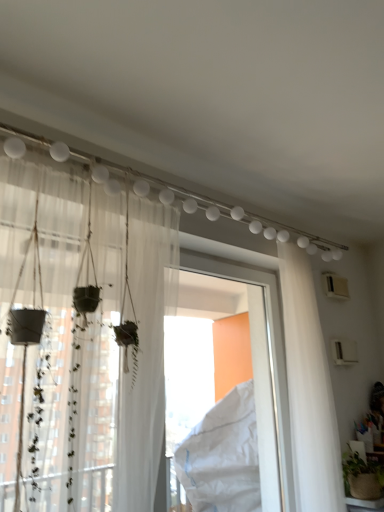
How much space does sheer white curtain at left, marked as the first curtain in a front-to-back arrangement, occupy vertically?

3.99 feet.

The width and height of the screenshot is (384, 512). In order to click on white sheer curtain at right, the second curtain in the left-to-right sequence in this screenshot , I will do `click(309, 389)`.

Would you say sheer white curtain at left, the second curtain when ordered from right to left, is inside or outside white plastic window frame at center?

sheer white curtain at left, the second curtain when ordered from right to left, is not enclosed by white plastic window frame at center.

Which point is more distant from viewer, (142, 232) or (269, 414)?

The point (269, 414) is more distant.

Considering the sizes of objects sheer white curtain at left, marked as the first curtain in a front-to-back arrangement, and white plastic window frame at center in the image provided, who is wider, sheer white curtain at left, marked as the first curtain in a front-to-back arrangement, or white plastic window frame at center?

Wider between the two is sheer white curtain at left, marked as the first curtain in a front-to-back arrangement.

Is sheer white curtain at left, the second curtain when ordered from right to left, bigger than white plastic window frame at center?

Yes, sheer white curtain at left, the second curtain when ordered from right to left, is bigger than white plastic window frame at center.

Is white sheer curtain at right, the 1th curtain viewed from the back, oriented towards white plastic window frame at center?

No, white sheer curtain at right, the 1th curtain viewed from the back, is not aimed at white plastic window frame at center.

Relative to white plastic window frame at center, is white sheer curtain at right, the 1th curtain viewed from the back, in front or behind?

In the image, white sheer curtain at right, the 1th curtain viewed from the back, appears behind white plastic window frame at center.

Is white sheer curtain at right, which ranks as the first curtain in right-to-left order, at the right side of white plastic window frame at center?

Correct, you'll find white sheer curtain at right, which ranks as the first curtain in right-to-left order, to the right of white plastic window frame at center.

From a real-world perspective, is white sheer curtain at right, which ranks as the first curtain in right-to-left order, physically above sheer white curtain at left, the second curtain when ordered from right to left?

No, from a real-world perspective, white sheer curtain at right, which ranks as the first curtain in right-to-left order, is not above sheer white curtain at left, the second curtain when ordered from right to left.

Can you confirm if white sheer curtain at right, the second curtain in the left-to-right sequence, is wider than sheer white curtain at left, marked as the first curtain in a front-to-back arrangement?

No.

How far apart are white sheer curtain at right, which ranks as the first curtain in right-to-left order, and sheer white curtain at left, the 2th curtain from the back?

white sheer curtain at right, which ranks as the first curtain in right-to-left order, and sheer white curtain at left, the 2th curtain from the back, are 1.02 meters apart.

From their relative heights in the image, would you say white sheer curtain at right, which ranks as the first curtain in right-to-left order, is taller or shorter than sheer white curtain at left, the 2th curtain from the back?

In the image, white sheer curtain at right, which ranks as the first curtain in right-to-left order, appears to be taller than sheer white curtain at left, the 2th curtain from the back.

How far apart are white plastic window frame at center and white sheer curtain at right, the 1th curtain viewed from the back?

24.78 centimeters.

Considering the sizes of objects white plastic window frame at center and white sheer curtain at right, the 1th curtain viewed from the back, in the image provided, who is bigger, white plastic window frame at center or white sheer curtain at right, the 1th curtain viewed from the back,?

Bigger between the two is white plastic window frame at center.

From the image's perspective, which object appears higher, white plastic window frame at center or white sheer curtain at right, the second curtain in the left-to-right sequence?

white sheer curtain at right, the second curtain in the left-to-right sequence, from the image's perspective.

Considering the sizes of white plastic window frame at center and white sheer curtain at right, the second curtain viewed from the front, in the image, is white plastic window frame at center taller or shorter than white sheer curtain at right, the second curtain viewed from the front,?

In the image, white plastic window frame at center appears to be shorter than white sheer curtain at right, the second curtain viewed from the front.

Considering the sizes of sheer white curtain at left, marked as the first curtain in a front-to-back arrangement, and white sheer curtain at right, the 1th curtain viewed from the back, in the image, is sheer white curtain at left, marked as the first curtain in a front-to-back arrangement, wider or thinner than white sheer curtain at right, the 1th curtain viewed from the back,?

Considering their sizes, sheer white curtain at left, marked as the first curtain in a front-to-back arrangement, looks broader than white sheer curtain at right, the 1th curtain viewed from the back.

From a real-world perspective, which is physically below, sheer white curtain at left, the second curtain when ordered from right to left, or white sheer curtain at right, which ranks as the first curtain in right-to-left order?

white sheer curtain at right, which ranks as the first curtain in right-to-left order.

Which is correct: sheer white curtain at left, the 1th curtain viewed from the left, is inside white sheer curtain at right, which ranks as the first curtain in right-to-left order, or outside of it?

sheer white curtain at left, the 1th curtain viewed from the left, is outside white sheer curtain at right, which ranks as the first curtain in right-to-left order.

Is sheer white curtain at left, the 2th curtain from the back, bigger than white sheer curtain at right, the second curtain viewed from the front?

Yes.

Is white plastic window frame at center turned away from sheer white curtain at left, the 1th curtain viewed from the left?

white plastic window frame at center does not have its back to sheer white curtain at left, the 1th curtain viewed from the left.

Can you confirm if white plastic window frame at center is thinner than sheer white curtain at left, the 2th curtain from the back?

Yes, white plastic window frame at center is thinner than sheer white curtain at left, the 2th curtain from the back.

Does white plastic window frame at center have a greater height compared to sheer white curtain at left, marked as the first curtain in a front-to-back arrangement?

Indeed, white plastic window frame at center has a greater height compared to sheer white curtain at left, marked as the first curtain in a front-to-back arrangement.

Is point (268, 282) positioned before point (112, 424)?

No, it is behind (112, 424).

From the image's perspective, starting from the white plastic window frame at center, which curtain is the 2nd one above? Please provide its 2D coordinates.

[(82, 337)]

Identify the location of window frame on the left of white sheer curtain at right, the second curtain viewed from the front. (262, 374).

Considering their positions, is white sheer curtain at right, the 1th curtain viewed from the back, positioned closer to white plastic window frame at center than sheer white curtain at left, the second curtain when ordered from right to left?

white sheer curtain at right, the 1th curtain viewed from the back, lies closer to white plastic window frame at center than the other object.

Based on their spatial positions, is white sheer curtain at right, the second curtain in the left-to-right sequence, or white plastic window frame at center further from sheer white curtain at left, the 2th curtain from the back?

white sheer curtain at right, the second curtain in the left-to-right sequence, is further to sheer white curtain at left, the 2th curtain from the back.

Estimate the real-world distances between objects in this image. Which object is further from sheer white curtain at left, the 2th curtain from the back, white plastic window frame at center or white sheer curtain at right, which ranks as the first curtain in right-to-left order?

white sheer curtain at right, which ranks as the first curtain in right-to-left order, is positioned further to the anchor sheer white curtain at left, the 2th curtain from the back.

Based on the photo, considering their positions, is sheer white curtain at left, the second curtain when ordered from right to left, positioned further to white sheer curtain at right, the 1th curtain viewed from the back, than white plastic window frame at center?

sheer white curtain at left, the second curtain when ordered from right to left.

Which object lies nearer to the anchor point white plastic window frame at center, sheer white curtain at left, the second curtain when ordered from right to left, or white sheer curtain at right, which ranks as the first curtain in right-to-left order?

Among the two, white sheer curtain at right, which ranks as the first curtain in right-to-left order, is located nearer to white plastic window frame at center.

Estimate the real-world distances between objects in this image. Which object is further from white sheer curtain at right, which ranks as the first curtain in right-to-left order, white plastic window frame at center or sheer white curtain at left, the 1th curtain viewed from the left?

The object further to white sheer curtain at right, which ranks as the first curtain in right-to-left order, is sheer white curtain at left, the 1th curtain viewed from the left.

Locate an element on the screen. Image resolution: width=384 pixels, height=512 pixels. window frame between sheer white curtain at left, the second curtain when ordered from right to left, and white sheer curtain at right, the 1th curtain viewed from the back, in the horizontal direction is located at coordinates (262, 374).